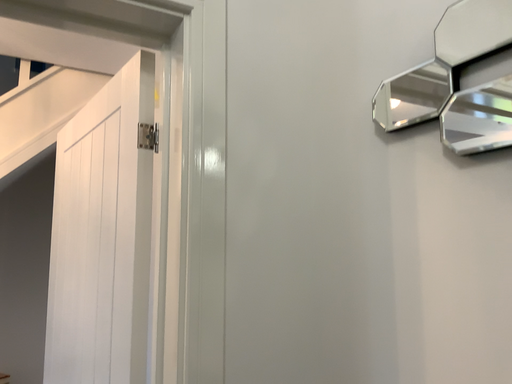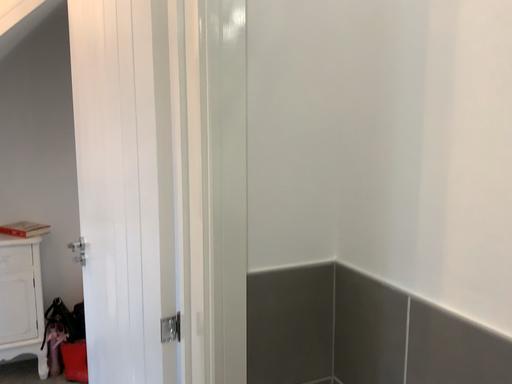
Question: Which way did the camera rotate in the video?

Choices:
 (A) rotated upward
 (B) rotated downward

Answer: (B)